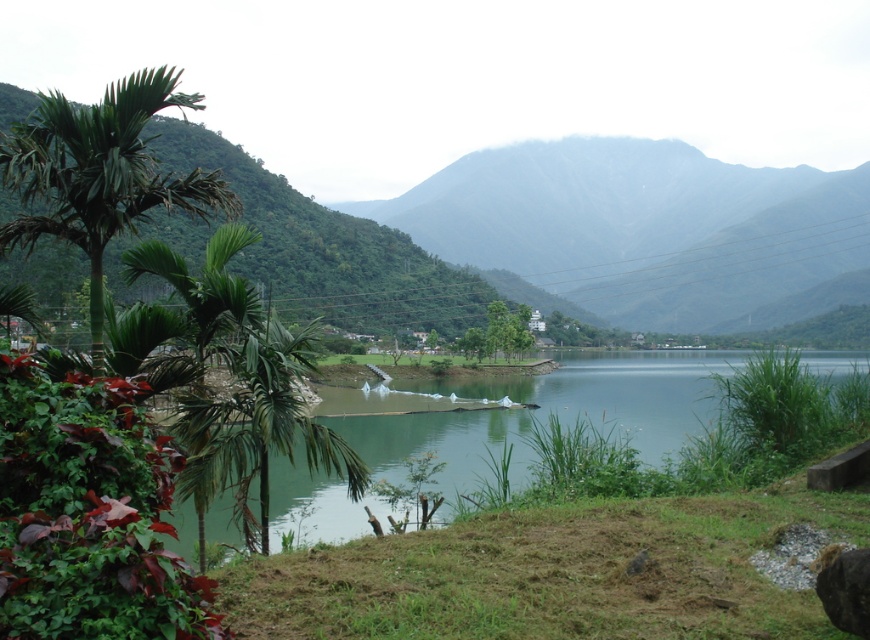
Question: Among these points, which one is nearest to the camera?

Choices:
 (A) (216, 484)
 (B) (367, 452)

Answer: (A)

Question: Which point is closer to the camera?

Choices:
 (A) (487, 355)
 (B) (98, 212)
 (C) (648, 444)

Answer: (B)

Question: From the image, what is the correct spatial relationship of green matte mountain at center in relation to green leafy palm at left?

Choices:
 (A) right
 (B) left

Answer: (A)

Question: Can you confirm if green matte mountain at center is positioned to the left of green leafy palm at left?

Choices:
 (A) yes
 (B) no

Answer: (B)

Question: Which of the following is the closest to the observer?

Choices:
 (A) green leafy palm at left
 (B) green leafy tree at center
 (C) green grassy lake at center

Answer: (C)

Question: Does green leafy palm at left have a lesser width compared to green leafy tree at center?

Choices:
 (A) no
 (B) yes

Answer: (A)